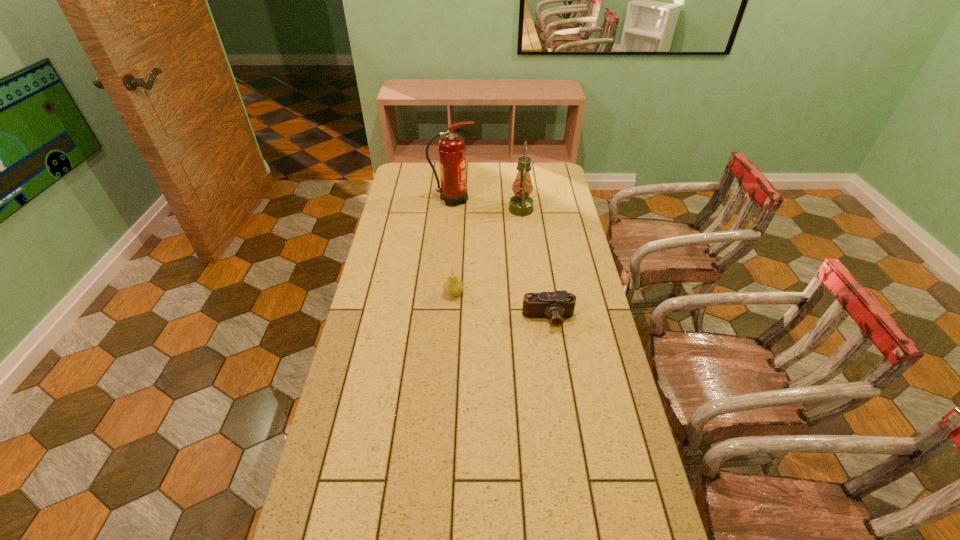
Image resolution: width=960 pixels, height=540 pixels. Identify the location of fire extinguisher. (452, 149).

Where is `the third shortest object`? the third shortest object is located at coordinates (521, 204).

In order to click on pear in this screenshot , I will do `click(452, 286)`.

Where is `the second shortest object`? The height and width of the screenshot is (540, 960). the second shortest object is located at coordinates (452, 286).

Find the location of a particular element. the shortest object is located at coordinates (556, 305).

This screenshot has width=960, height=540. In order to click on the nearest object in this screenshot , I will do `click(556, 305)`.

Identify the location of vacant region located 0.320m on the front-facing side of the fire extinguisher. This screenshot has width=960, height=540. (543, 199).

You are a GUI agent. You are given a task and a screenshot of the screen. Output one action in this format:
    pyautogui.click(x=<x>, y=<y>)
    Task: Click on the free point located 0.260m on the front of the third shortest object
    This screenshot has width=960, height=540.
    Given the screenshot: What is the action you would take?
    pyautogui.click(x=527, y=257)

The image size is (960, 540). In order to click on free space located 0.190m on the right of the third tallest object in this screenshot , I will do `click(516, 294)`.

Locate an element on the screen. Image resolution: width=960 pixels, height=540 pixels. free space located on the front-facing side of the nearest object is located at coordinates (554, 352).